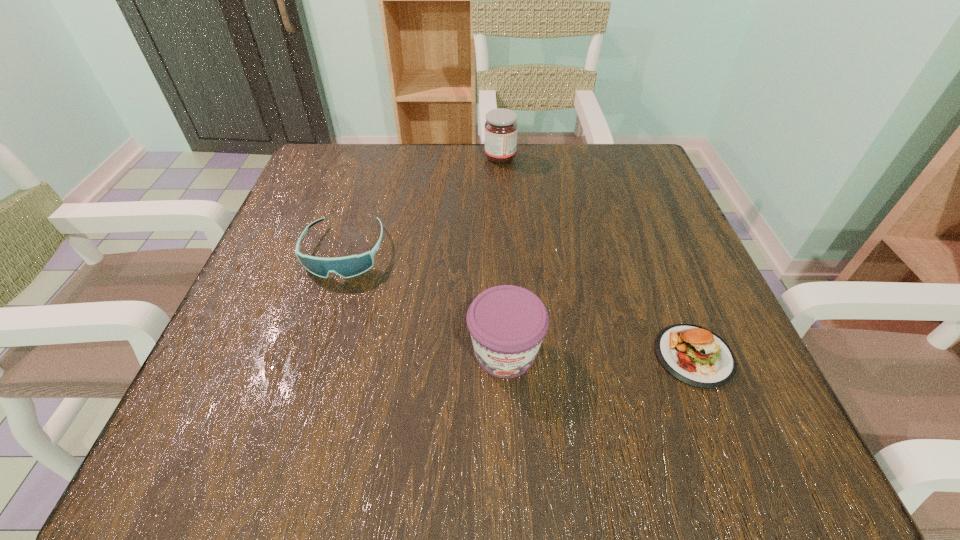
Identify the location of the farther jam. The image size is (960, 540). (501, 128).

In order to click on the nearer jam in this screenshot , I will do `click(507, 323)`.

Where is `the second farthest object`? the second farthest object is located at coordinates (350, 266).

At what (x,y) coordinates should I click in order to perform the action: click on the leftmost object. Please return your answer as a coordinate pair (x, y). This screenshot has height=540, width=960. Looking at the image, I should click on (350, 266).

The image size is (960, 540). I want to click on patty (food), so click(x=694, y=355).

Where is `the shortest object`? This screenshot has height=540, width=960. the shortest object is located at coordinates (694, 355).

This screenshot has height=540, width=960. Identify the location of free location located 0.250m on the right of the farthest object. (621, 158).

Locate an element on the screen. The height and width of the screenshot is (540, 960). free space located on the front label of the nearer jam is located at coordinates (509, 434).

Image resolution: width=960 pixels, height=540 pixels. Find the location of `vacant position located 0.200m on the front-facing side of the second farthest object`. vacant position located 0.200m on the front-facing side of the second farthest object is located at coordinates (303, 384).

What are the coordinates of `vacant space located on the back of the shortest object` in the screenshot? It's located at (633, 201).